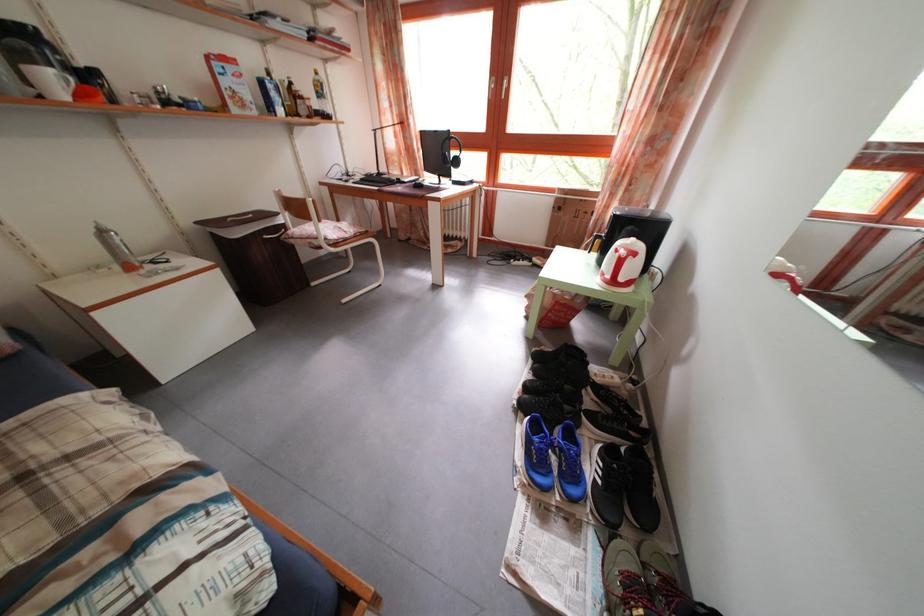
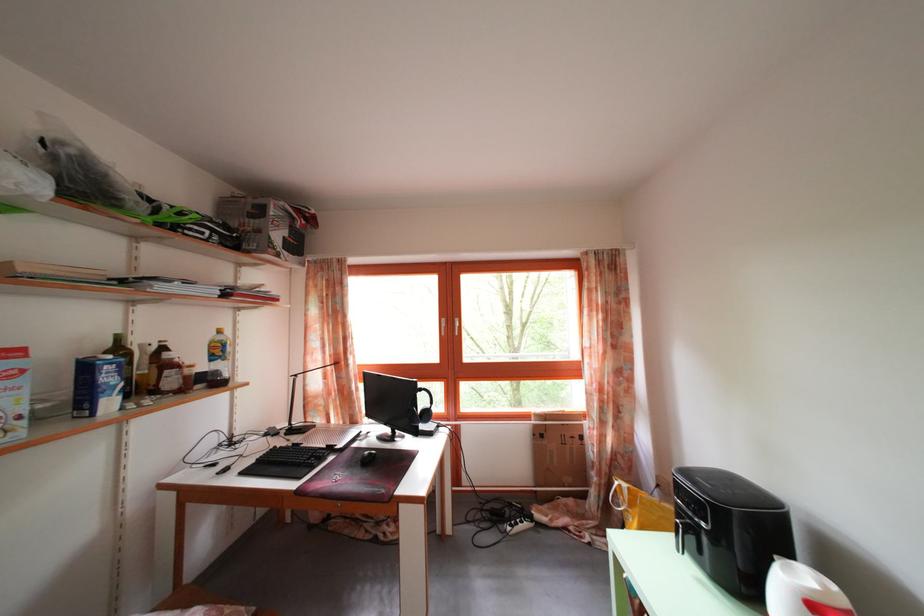
Locate, in the second image, the point that corresponds to (286,118) in the first image.

(117, 410)